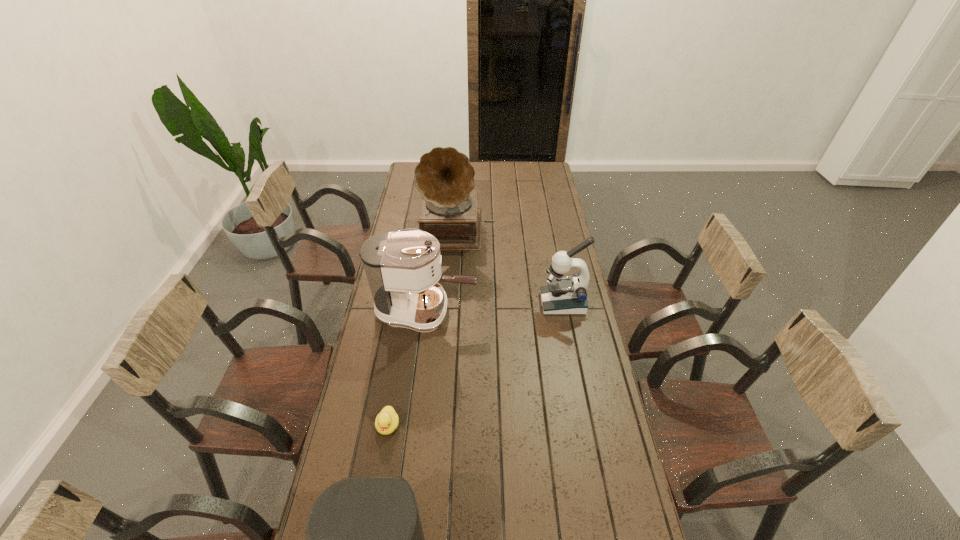
You are a GUI agent. You are given a task and a screenshot of the screen. Output one action in this format:
    pyautogui.click(x=<x>, y=<y>)
    Task: Click on the free space between the rightmost object and the duckling
    
    Given the screenshot: What is the action you would take?
    pyautogui.click(x=475, y=364)

Where is `free area in between the fourth farthest object and the microscope`? free area in between the fourth farthest object and the microscope is located at coordinates (475, 364).

The width and height of the screenshot is (960, 540). I want to click on free space between the microscope and the second nearest object, so click(475, 364).

Identify the location of unoccupied position between the rightmost object and the second nearest object. click(x=475, y=364).

Where is `the fourth closest object to the record player`? The height and width of the screenshot is (540, 960). the fourth closest object to the record player is located at coordinates (364, 536).

Where is `object that is the second closest one to the microscope`? The image size is (960, 540). object that is the second closest one to the microscope is located at coordinates (444, 176).

You are a GUI agent. You are given a task and a screenshot of the screen. Output one action in this format:
    pyautogui.click(x=<x>, y=<y>)
    Task: Click on the blank space that satisfies the following two spatial constraints: 1. on the front-facing side of the taller coffee maker; 2. on the beak of the duckling
    Image resolution: width=960 pixels, height=540 pixels.
    Given the screenshot: What is the action you would take?
    pyautogui.click(x=411, y=426)

This screenshot has width=960, height=540. Find the location of `vacant position in the image that satisfies the following two spatial constraints: 1. at the eyepiece of the rightmost object; 2. on the beak of the shortest object`. vacant position in the image that satisfies the following two spatial constraints: 1. at the eyepiece of the rightmost object; 2. on the beak of the shortest object is located at coordinates (587, 426).

Where is `free spot that satisfies the following two spatial constraints: 1. from the horn of the tallest object; 2. on the front-facing side of the farther coffee maker`? Image resolution: width=960 pixels, height=540 pixels. free spot that satisfies the following two spatial constraints: 1. from the horn of the tallest object; 2. on the front-facing side of the farther coffee maker is located at coordinates (451, 311).

At what (x,y) coordinates should I click in order to perform the action: click on vacant area in the image that satisfies the following two spatial constraints: 1. on the front-facing side of the taller coffee maker; 2. on the beak of the fourth farthest object. Please return your answer as a coordinate pair (x, y). Looking at the image, I should click on coord(411,426).